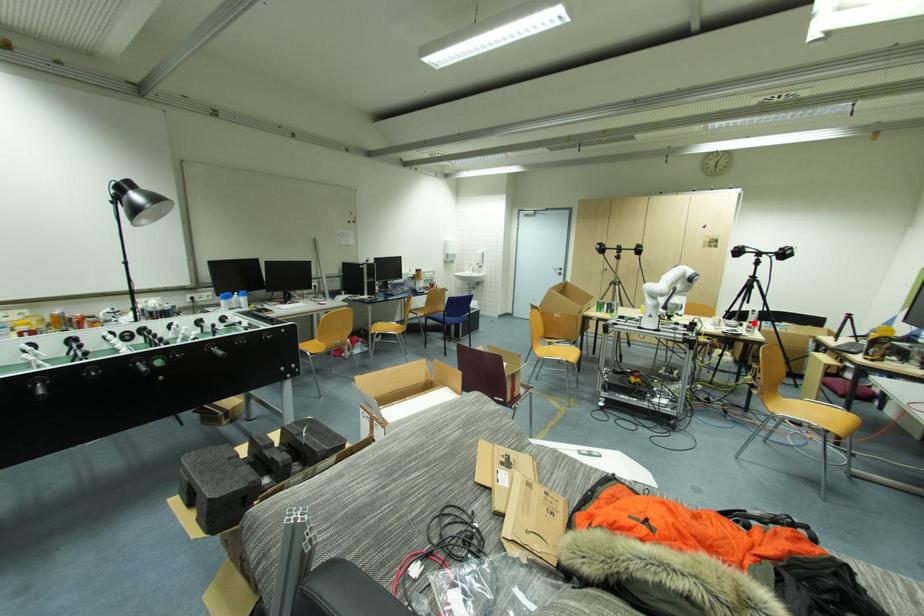
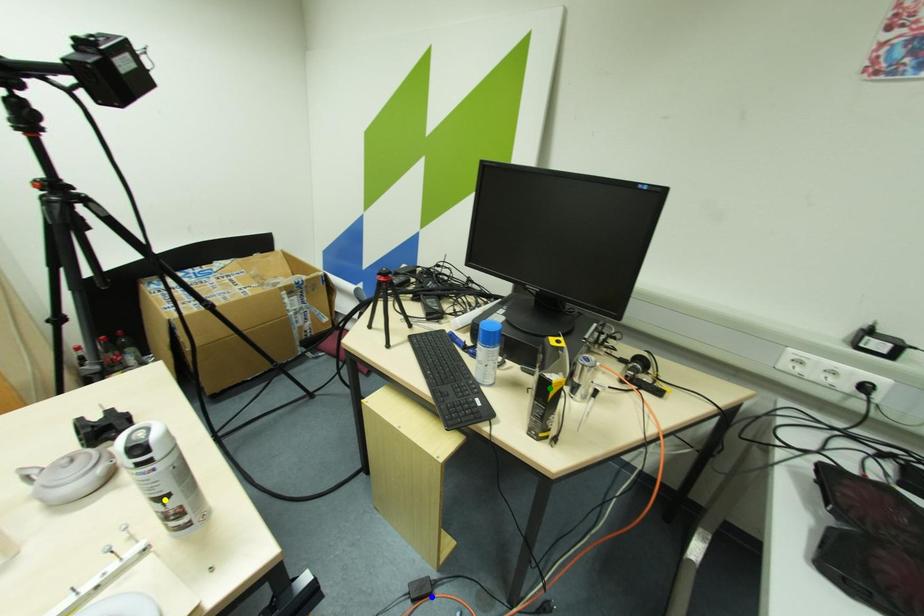
Question: I am providing you with two images of the same scene from different viewpoints. A red point is marked on the first image. You are given multiple points on the second image. Which spot in image 2 lines up with the point in image 1?

Choices:
 (A) green point
 (B) blue point
 (C) yellow point

Answer: (C)